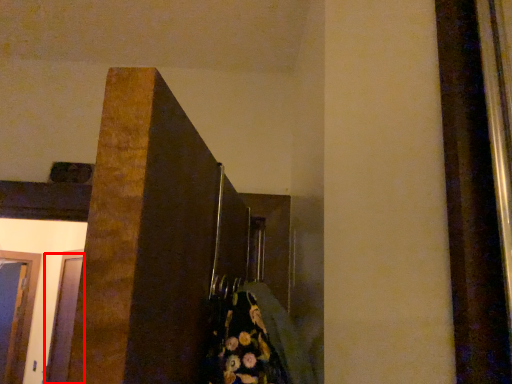
Question: From the image, what is the correct spatial relationship of glass door (annotated by the red box) in relation to glass door?

Choices:
 (A) right
 (B) left

Answer: (A)